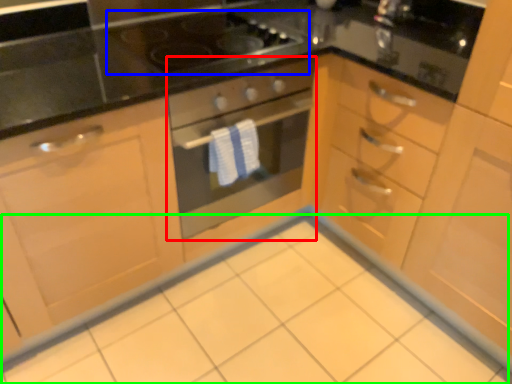
Question: Which object is positioned closest to oven (highlighted by a red box)? Select from gas stove (highlighted by a blue box) and ceramic tile (highlighted by a green box).

Choices:
 (A) gas stove
 (B) ceramic tile

Answer: (A)